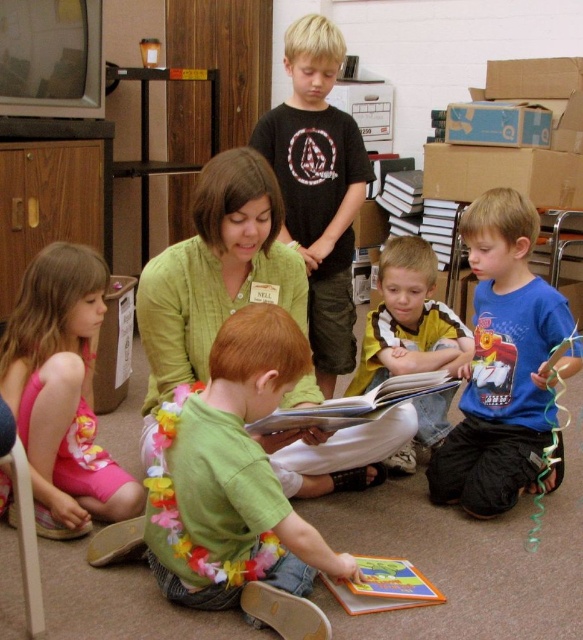
Question: Which point is closer to the camera taking this photo?

Choices:
 (A) (262, 328)
 (B) (364, 369)
 (C) (367, 474)

Answer: (A)

Question: Which object appears farthest from the camera in this image?

Choices:
 (A) green knitted sweater at center
 (B) blue cotton shirt at center
 (C) yellow/white striped shirt at center
 (D) green fabric shirt at center

Answer: (A)

Question: Can you confirm if blue cotton shirt at center is wider than yellow/white striped shirt at center?

Choices:
 (A) yes
 (B) no

Answer: (A)

Question: Which point is farther to the camera?

Choices:
 (A) pos(166,515)
 (B) pos(229,193)
 (C) pos(308,42)

Answer: (C)

Question: Does green fabric shirt at center appear over hardcover book at center?

Choices:
 (A) no
 (B) yes

Answer: (A)

Question: Is pink fabric dress at lower left below hardcover book at lower center?

Choices:
 (A) yes
 (B) no

Answer: (B)